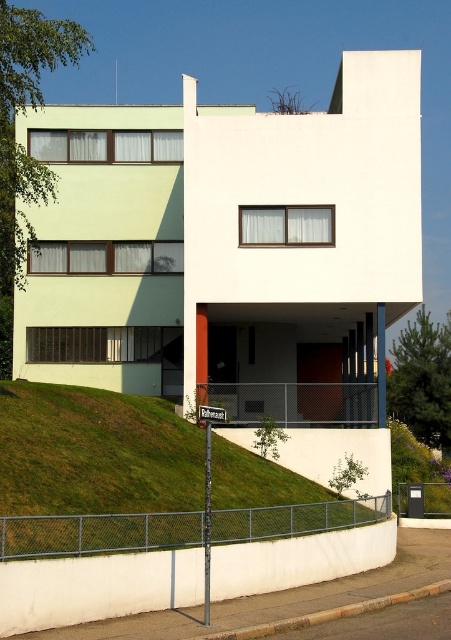
You are standing in front of the modernist building and want to determine the relative positions of two points marked on its facade. Which point, point (369,522) or point (351,422), is closer to your viewpoint?

Point (369,522) is closer to the camera than point (351,422).

You are standing in front of the modernist building and notice two points marked on its facade. The first point is at coordinate point (64, 413) and the second is at point (294, 404). Which point appears closer to you when looking at the building?

Point (64, 413) is closer to the camera than point (294, 404), so the first point appears closer to you.